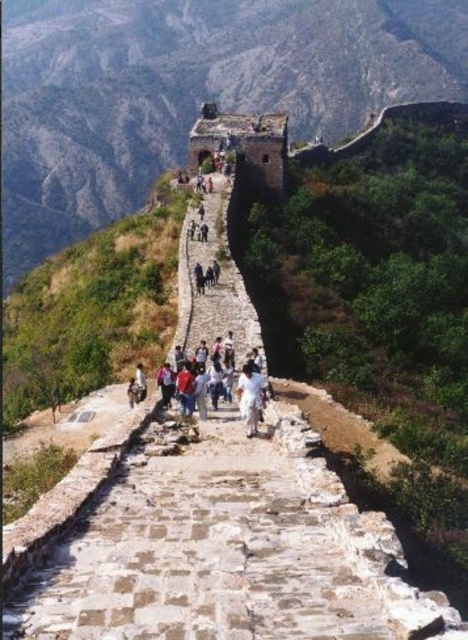
Can you confirm if brown stone wall at upper center is positioned to the right of white cotton shirt at center?

Yes, brown stone wall at upper center is to the right of white cotton shirt at center.

Which of these two, brown stone wall at upper center or white cotton shirt at center, stands taller?

brown stone wall at upper center is taller.

Does point (89, 188) come behind point (243, 390)?

Yes, it is.

Find the location of a particular element. This screenshot has height=640, width=468. brown stone wall at upper center is located at coordinates (190, 90).